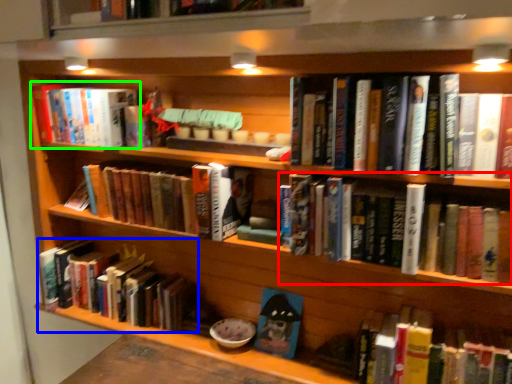
Question: Which object is the closest to the book (highlighted by a red box)? Choose among these: book (highlighted by a blue box) or book (highlighted by a green box).

Choices:
 (A) book
 (B) book

Answer: (A)